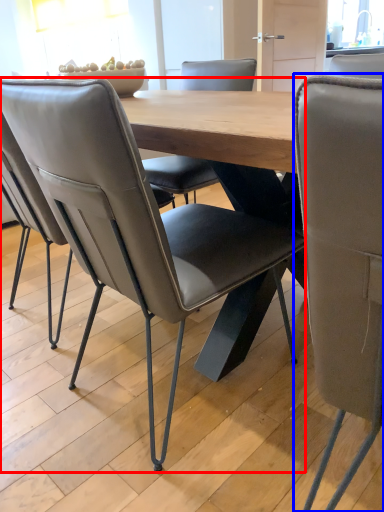
Question: Which point is further to the camera, chair (highlighted by a red box) or chair (highlighted by a blue box)?

Choices:
 (A) chair
 (B) chair

Answer: (A)